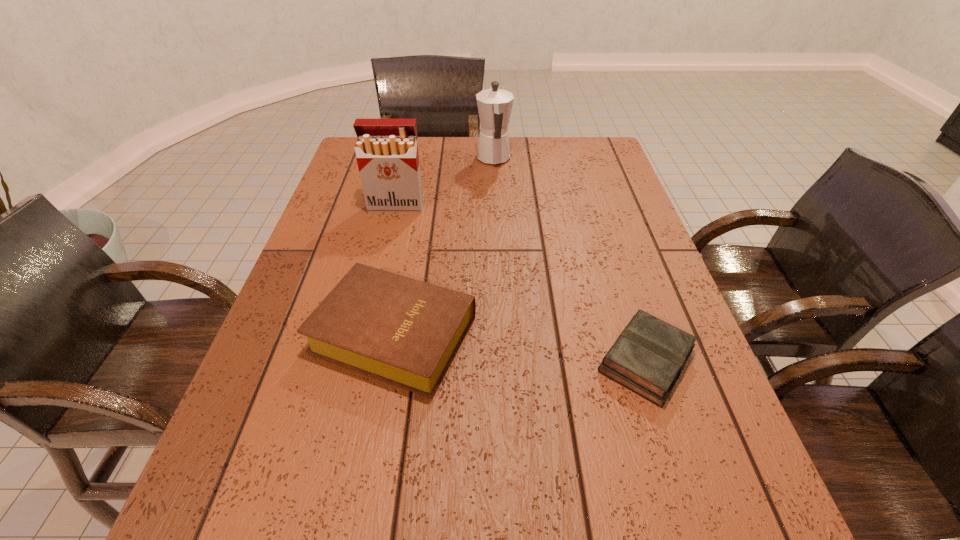
What are the coordinates of `cigarette case present at the left edge` in the screenshot? It's located at (386, 150).

At what (x,y) coordinates should I click in order to perform the action: click on Bible at the left edge. Please return your answer as a coordinate pair (x, y). Looking at the image, I should click on (405, 332).

The height and width of the screenshot is (540, 960). What are the coordinates of `object that is at the right edge` in the screenshot? It's located at (649, 355).

In the image, there is a desktop. Identify the location of vacant space at the far edge. (451, 163).

In the image, there is a desktop. Identify the location of vacant space at the left edge. (219, 452).

In the image, there is a desktop. At what (x,y) coordinates should I click in order to perform the action: click on free space at the right edge. Please return your answer as a coordinate pair (x, y). The height and width of the screenshot is (540, 960). Looking at the image, I should click on (587, 186).

Find the location of a particular element. vacant space that is in between the Bible and the book is located at coordinates (520, 347).

Where is `vacant area between the second shortest object and the shortest object`? vacant area between the second shortest object and the shortest object is located at coordinates (520, 347).

Image resolution: width=960 pixels, height=540 pixels. In order to click on unoccupied area between the second shortest object and the farthest object in this screenshot , I will do `click(444, 246)`.

At what (x,y) coordinates should I click in order to perform the action: click on empty space between the coffeepot and the second farthest object. Please return your answer as a coordinate pair (x, y). The image size is (960, 540). Looking at the image, I should click on (444, 183).